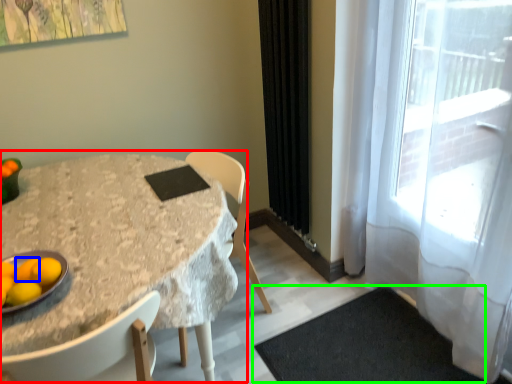
Question: Based on their relative distances, which object is farther from table (highlighted by a red box)? Choose from tangerine (highlighted by a blue box) and doormat (highlighted by a green box).

Choices:
 (A) tangerine
 (B) doormat

Answer: (B)